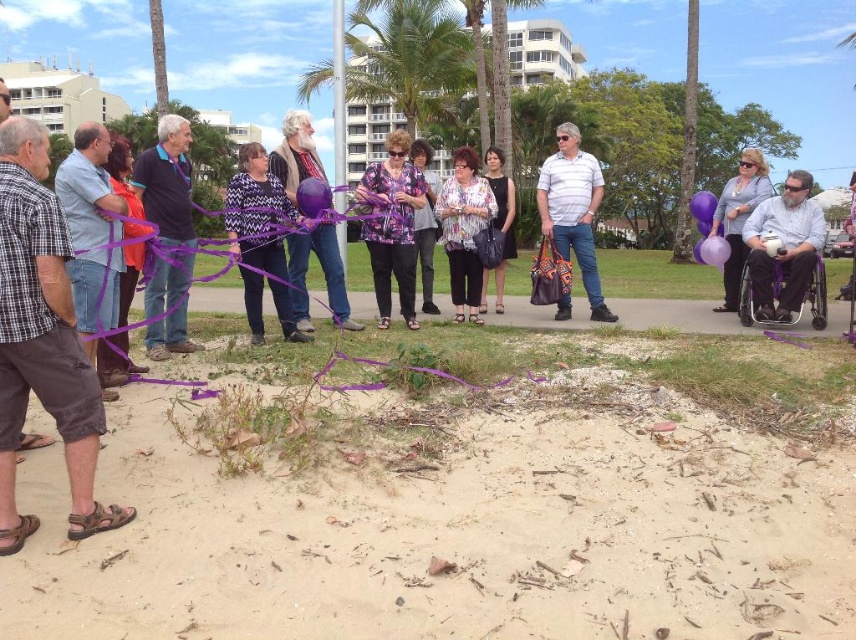
You are standing at the center of the image and want to walk to the beige sand at lower center. Which direction should you move?

The beige sand at lower center is located at point (462,499), so you should move downward and to the right to reach it.

You are a photographer standing at the edge of the beige sand at lower center and want to take a photo of the matte purple balloon at right. Which object is closer to your camera lens?

The beige sand at lower center is closer to the viewer than the matte purple balloon at right, so the beige sand at lower center will appear closer to the camera lens in the photo.